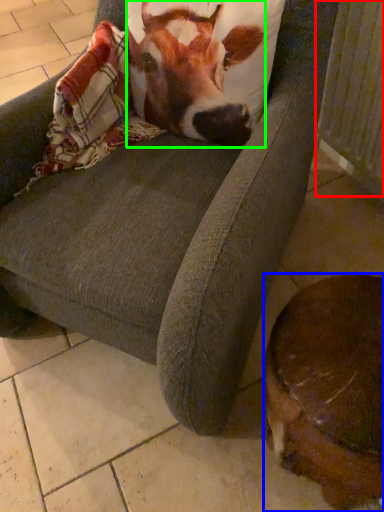
Question: Estimate the real-world distances between objects in this image. Which object is farther from radiator (highlighted by a red box), dog (highlighted by a blue box) or cattle (highlighted by a green box)?

Choices:
 (A) dog
 (B) cattle

Answer: (A)